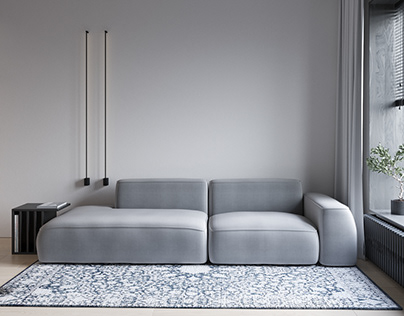
The width and height of the screenshot is (404, 316). I want to click on bars hanging on the wall, so click(x=86, y=99), click(x=103, y=91).